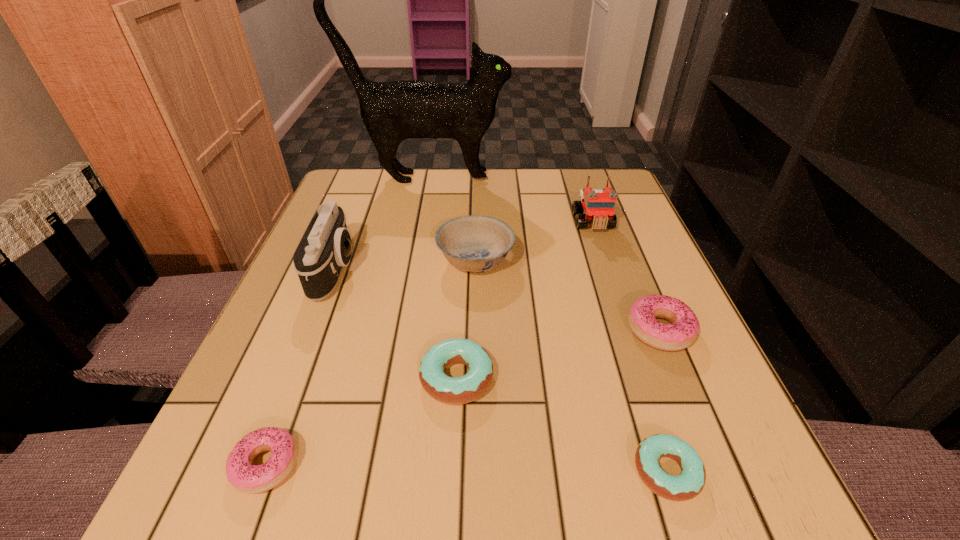
Locate an element on the screen. object at the near left corner is located at coordinates (252, 479).

Where is `object present at the far right corner`? This screenshot has width=960, height=540. object present at the far right corner is located at coordinates (599, 205).

The width and height of the screenshot is (960, 540). What are the coordinates of `object that is at the near right corner` in the screenshot? It's located at (690, 482).

In the image, there is a desktop. Where is `free space at the far edge`? free space at the far edge is located at coordinates (527, 189).

Find the location of `vacant space at the near edge of the desktop`. vacant space at the near edge of the desktop is located at coordinates (421, 518).

Locate an element on the screen. This screenshot has width=960, height=540. free region at the left edge of the desktop is located at coordinates (318, 373).

Where is `free space at the far left corner of the desktop`? The height and width of the screenshot is (540, 960). free space at the far left corner of the desktop is located at coordinates (378, 179).

Locate an element on the screen. The image size is (960, 540). vacant space at the far right corner of the desktop is located at coordinates (624, 191).

The image size is (960, 540). What are the coordinates of `empty space between the bowl and the farther pink doughnut` in the screenshot? It's located at (567, 295).

Locate an element on the screen. empty location between the camera and the fifth tallest object is located at coordinates (497, 300).